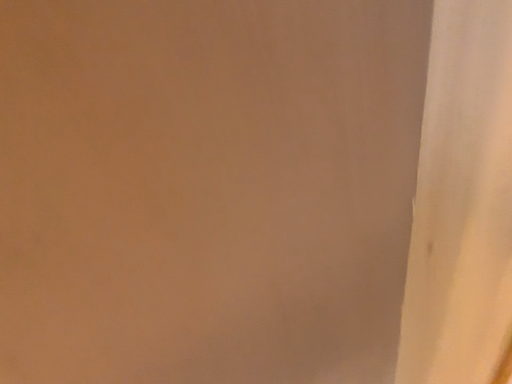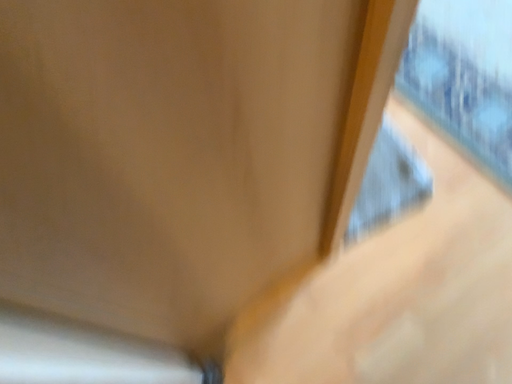
Question: Which way did the camera rotate in the video?

Choices:
 (A) rotated right
 (B) rotated left

Answer: (A)